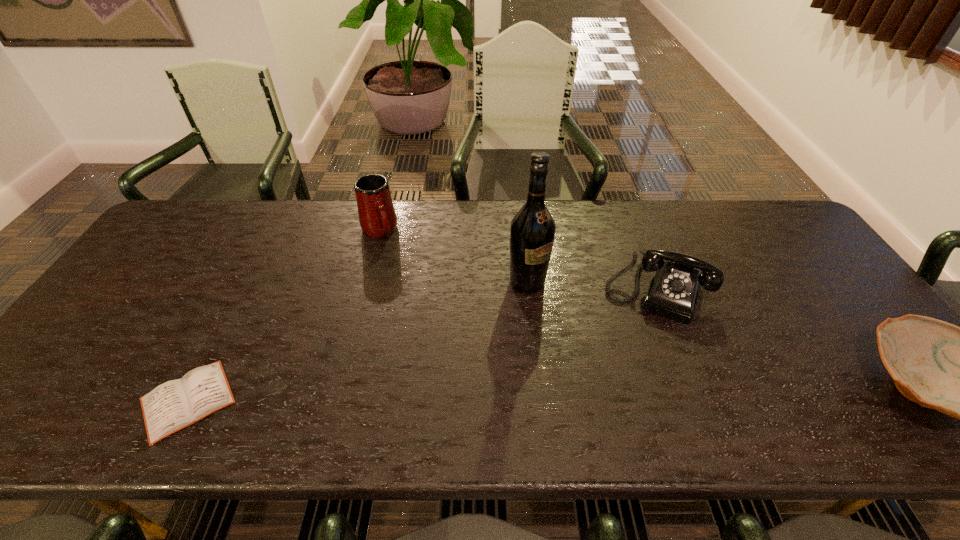
Locate an element on the screen. The width and height of the screenshot is (960, 540). the leftmost object is located at coordinates (176, 404).

Identify the location of diary. The image size is (960, 540). (176, 404).

Identify the location of telephone. (673, 290).

The image size is (960, 540). What are the coordinates of `the third shortest object` in the screenshot? It's located at (673, 290).

Locate an element on the screen. Image resolution: width=960 pixels, height=540 pixels. wine bottle is located at coordinates (532, 232).

You are a GUI agent. You are given a task and a screenshot of the screen. Output one action in this format:
    pyautogui.click(x=<x>, y=<y>)
    Task: Click on the tallest object
    The width and height of the screenshot is (960, 540).
    Given the screenshot: What is the action you would take?
    pyautogui.click(x=532, y=232)

Where is `the fourth object from right to left`? The height and width of the screenshot is (540, 960). the fourth object from right to left is located at coordinates (377, 217).

Where is `the fourth shortest object`? The image size is (960, 540). the fourth shortest object is located at coordinates (377, 217).

Where is `free space located 0.290m on the back of the diary`? This screenshot has width=960, height=540. free space located 0.290m on the back of the diary is located at coordinates click(x=252, y=275).

Locate an element on the screen. The image size is (960, 540). blank space located on the dial of the fourth object from left to right is located at coordinates (637, 339).